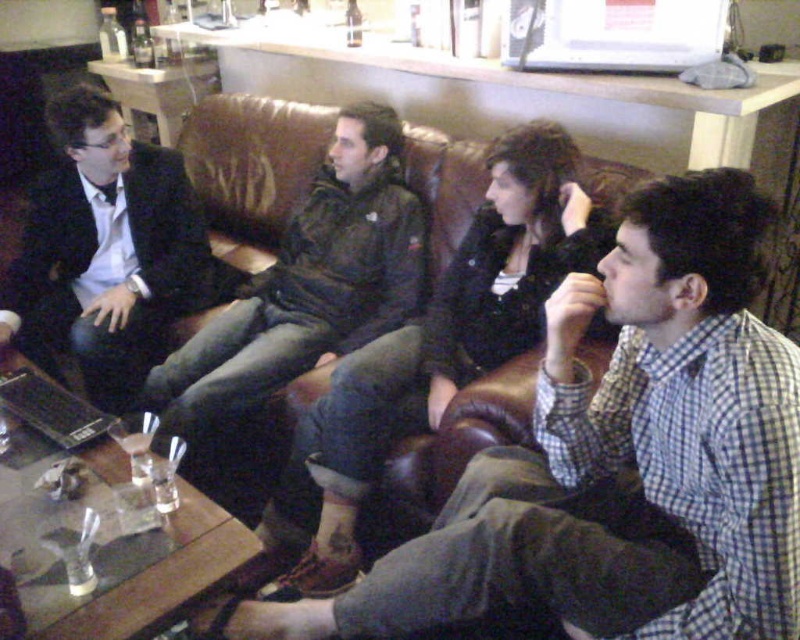
Does leather jacket at center have a lesser height compared to dark green jacket at center?

Indeed, leather jacket at center has a lesser height compared to dark green jacket at center.

Which is more to the left, leather jacket at center or dark green jacket at center?

From the viewer's perspective, dark green jacket at center appears more on the left side.

Is point (450, 552) closer to camera compared to point (424, 241)?

Yes, it is in front of point (424, 241).

I want to click on leather jacket at center, so click(621, 458).

Does dark green jacket at center appear on the left side of black plastic laptop at lower left?

No, dark green jacket at center is not to the left of black plastic laptop at lower left.

Is the position of dark green jacket at center less distant than that of black plastic laptop at lower left?

That is False.

Is point (412, 278) farther from camera compared to point (38, 426)?

Yes, it is.

Where is `dark green jacket at center`? This screenshot has width=800, height=640. dark green jacket at center is located at coordinates (308, 284).

Between matte black suit at left and dark green jacket at center, which one is positioned lower?

dark green jacket at center

Can you confirm if matte black suit at left is positioned to the left of dark green jacket at center?

Yes, matte black suit at left is to the left of dark green jacket at center.

The width and height of the screenshot is (800, 640). Describe the element at coordinates (106, 252) in the screenshot. I see `matte black suit at left` at that location.

Identify the location of matte black suit at left. (106, 252).